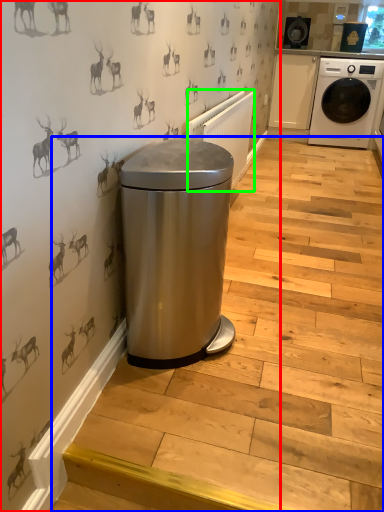
Question: Which object is the closest to the backdrop (highlighted by a red box)? Choose among these: stairwell (highlighted by a blue box) or radiator (highlighted by a green box).

Choices:
 (A) stairwell
 (B) radiator

Answer: (B)